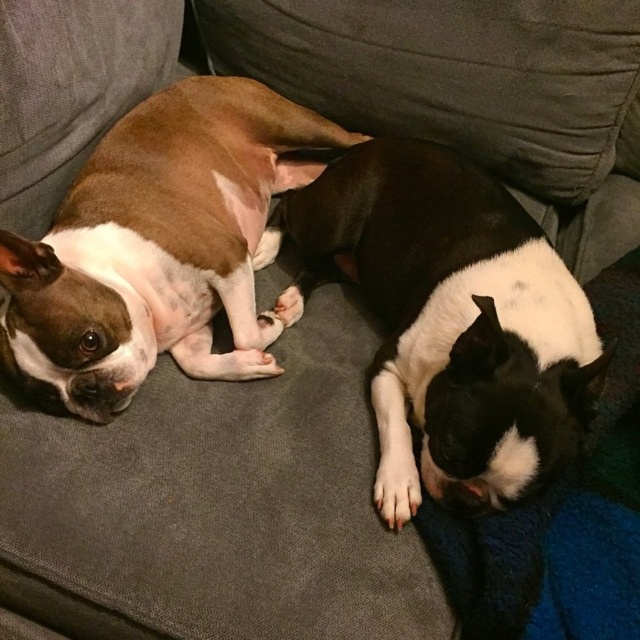
Question: Observing the image, what is the correct spatial positioning of black/white fur dog at lower right in reference to brown matte dog at left?

Choices:
 (A) right
 (B) left

Answer: (A)

Question: Is black/white fur dog at lower right below brown matte dog at left?

Choices:
 (A) yes
 (B) no

Answer: (A)

Question: Is black/white fur dog at lower right to the left of brown matte dog at left from the viewer's perspective?

Choices:
 (A) no
 (B) yes

Answer: (A)